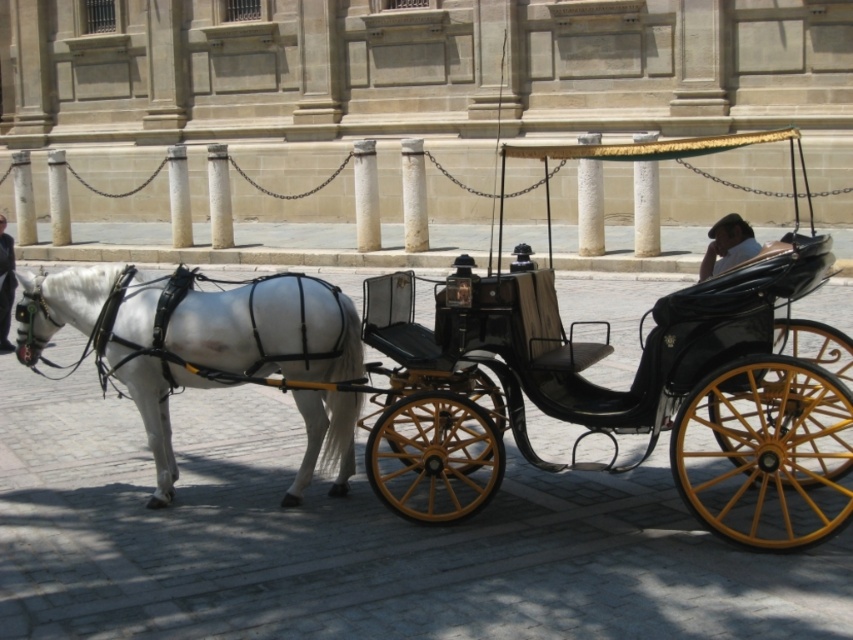
Which is more to the right, shiny black carriage at center or white glossy horse at left?

shiny black carriage at center is more to the right.

Who is more distant from viewer, (x=450, y=356) or (x=289, y=490)?

The point (x=289, y=490) is more distant.

Locate an element on the screen. Image resolution: width=853 pixels, height=640 pixels. shiny black carriage at center is located at coordinates (619, 394).

Is light brown leather hat at upper right smaller than dark blue leather jacket at center?

No.

I want to click on light brown leather hat at upper right, so click(x=727, y=244).

Find the location of `shiny black carriage at center`. shiny black carriage at center is located at coordinates coord(619,394).

From the picture: Can you confirm if shiny black carriage at center is taller than light brown leather hat at upper right?

Incorrect, shiny black carriage at center's height is not larger of light brown leather hat at upper right's.

I want to click on shiny black carriage at center, so click(619, 394).